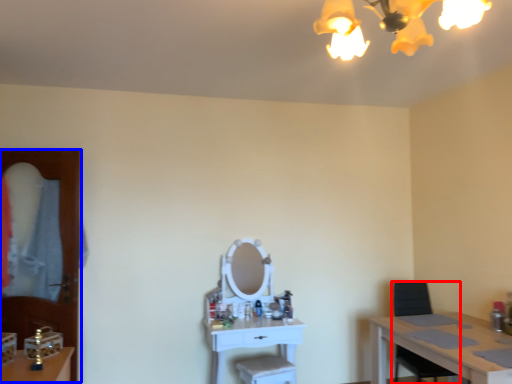
Question: Which object appears farthest to the camera in this image, armchair (highlighted by a red box) or glass door (highlighted by a blue box)?

Choices:
 (A) armchair
 (B) glass door

Answer: (B)